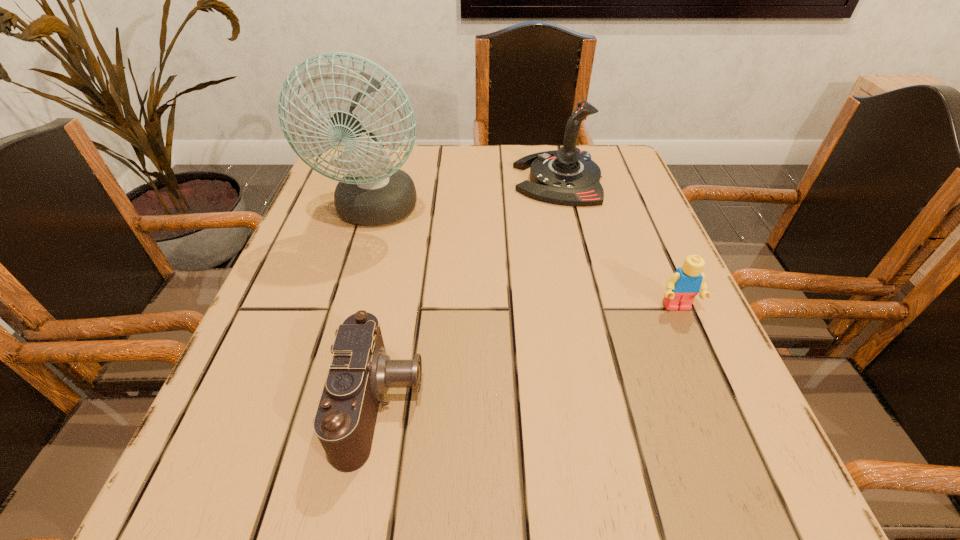
At what (x,y) coordinates should I click in order to perform the action: click on vacant region located 0.120m on the front-facing side of the second nearest object. Please return your answer as a coordinate pair (x, y). Looking at the image, I should click on (707, 377).

You are a GUI agent. You are given a task and a screenshot of the screen. Output one action in this format:
    pyautogui.click(x=<x>, y=<y>)
    Task: Click on the free space located 0.300m on the front-facing side of the camera
    
    Given the screenshot: What is the action you would take?
    pyautogui.click(x=633, y=403)

This screenshot has width=960, height=540. Find the location of `fan that is at the far edge`. fan that is at the far edge is located at coordinates (373, 192).

Locate an element on the screen. joystick present at the far edge is located at coordinates (567, 176).

Locate an element on the screen. object that is at the near edge is located at coordinates (360, 372).

Locate an element on the screen. The width and height of the screenshot is (960, 540). object at the left edge is located at coordinates (373, 192).

At what (x,y) coordinates should I click in order to perform the action: click on joystick that is at the right edge. Please return your answer as a coordinate pair (x, y). Image resolution: width=960 pixels, height=540 pixels. Looking at the image, I should click on (567, 176).

Identify the location of Lego positioned at the right edge. The height and width of the screenshot is (540, 960). (682, 286).

At what (x,y) coordinates should I click in order to perform the action: click on object that is at the far left corner. Please return your answer as a coordinate pair (x, y). This screenshot has height=540, width=960. Looking at the image, I should click on (373, 192).

The width and height of the screenshot is (960, 540). Find the location of `object present at the far right corner`. object present at the far right corner is located at coordinates (567, 176).